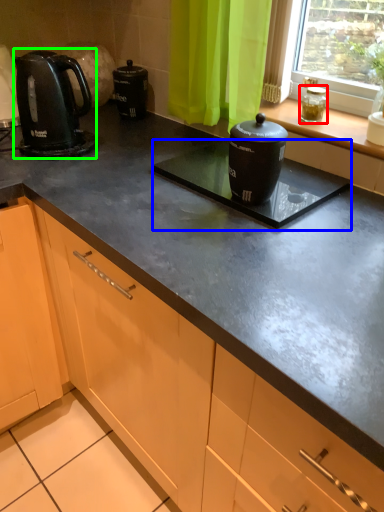
Question: Based on their relative distances, which object is farther from appliance (highlighted by a red box)? Choose from appliance (highlighted by a blue box) and kitchen appliance (highlighted by a green box).

Choices:
 (A) appliance
 (B) kitchen appliance

Answer: (B)